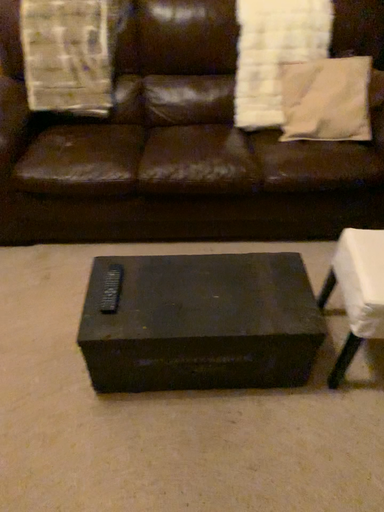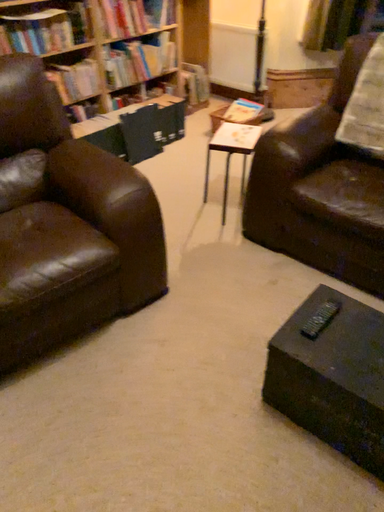
Question: Which way did the camera rotate in the video?

Choices:
 (A) rotated upward
 (B) rotated downward

Answer: (A)